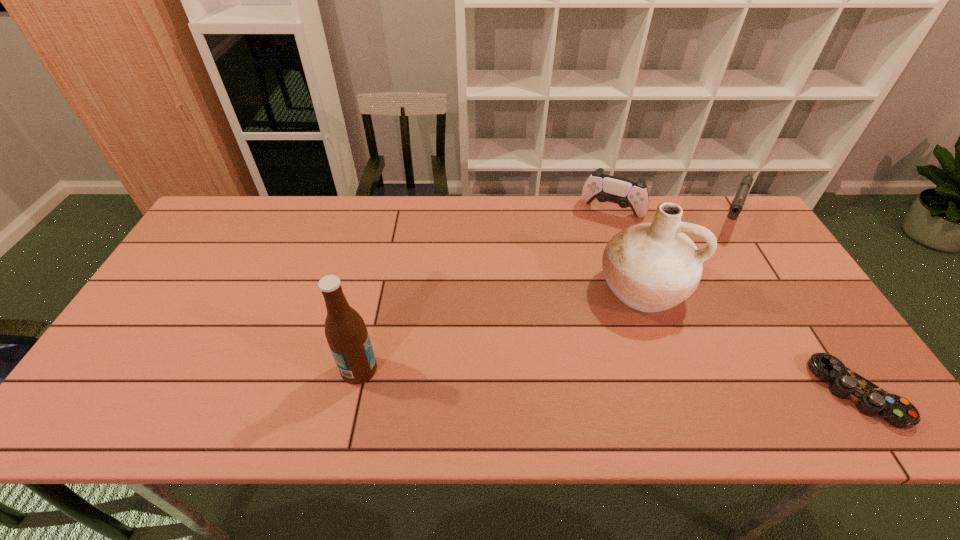
The width and height of the screenshot is (960, 540). Find the location of `beer bottle at the near edge`. beer bottle at the near edge is located at coordinates (346, 333).

Where is `control present at the near edge`? This screenshot has width=960, height=540. control present at the near edge is located at coordinates point(870,399).

Where is `control present at the right edge`? The image size is (960, 540). control present at the right edge is located at coordinates (870, 399).

You are a GUI agent. You are given a task and a screenshot of the screen. Output one action in this format:
    pyautogui.click(x=<x>, y=<y>)
    Task: Click on the gun at the right edge
    The height and width of the screenshot is (540, 960).
    Given the screenshot: What is the action you would take?
    (737, 204)

Locate an element on the screen. This screenshot has width=960, height=540. object at the far right corner is located at coordinates (737, 204).

Find the location of a particular element. object at the near right corner is located at coordinates (870, 399).

The width and height of the screenshot is (960, 540). Find the location of `free location at the far edge`. free location at the far edge is located at coordinates (420, 213).

Locate an element on the screen. The width and height of the screenshot is (960, 540). free space at the near edge is located at coordinates (661, 389).

The width and height of the screenshot is (960, 540). In the image, there is a desktop. Find the location of `free region at the right edge`. free region at the right edge is located at coordinates (753, 245).

Locate an element on the screen. This screenshot has width=960, height=540. vacant space at the far right corner of the desktop is located at coordinates (747, 222).